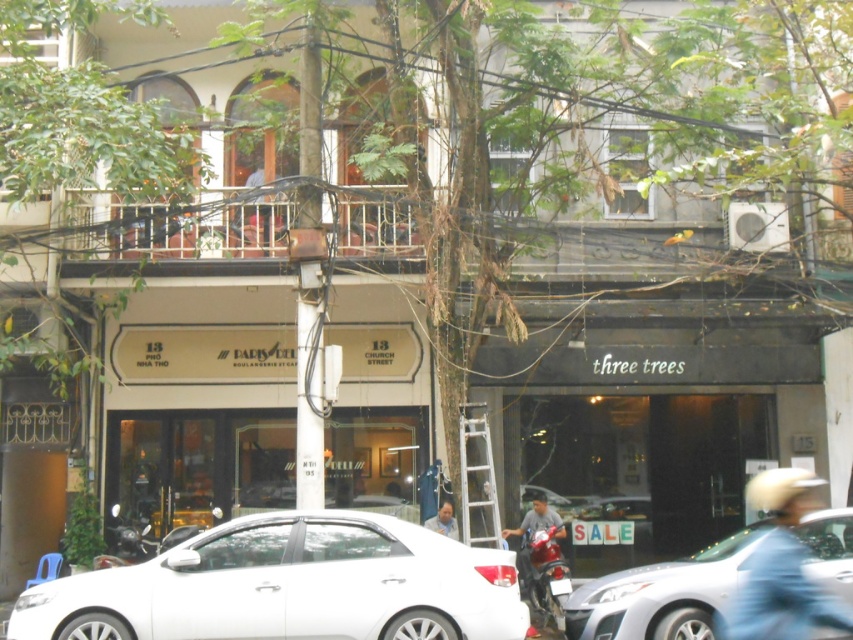
You are a photographer standing on the sidewalk trying to capture a photo of the Paris Deli sign. There are two points in your viewfinder labeled as point 1 at coordinates point (720, 632) and point 2 at coordinates point (549, 572). Which point should you focus on to ensure the Paris Deli sign is in sharp focus?

You should focus on point 1 at coordinates point (720, 632) because it is closer to the camera, making it easier to capture the Paris Deli sign in sharp focus.

You are a pedestrian standing on the sidewalk and see both the shiny red motorcycle at lower right and the light blue shirt at center. Which object is located to the right of the other?

The shiny red motorcycle at lower right is positioned on the right side of light blue shirt at center.

You are a pedestrian standing on the sidewalk and see the shiny red motorcycle at lower right and the light blue shirt at center. Which object is nearer to you?

The shiny red motorcycle at lower right is closer to the viewer than the light blue shirt at center.